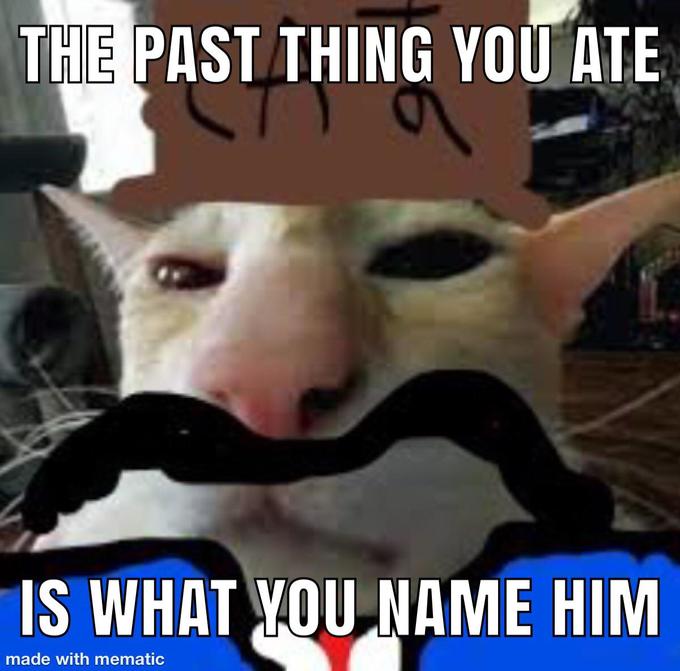
Locate an element on the screen. Image resolution: width=680 pixels, height=671 pixels. fireplace is located at coordinates (670, 278).